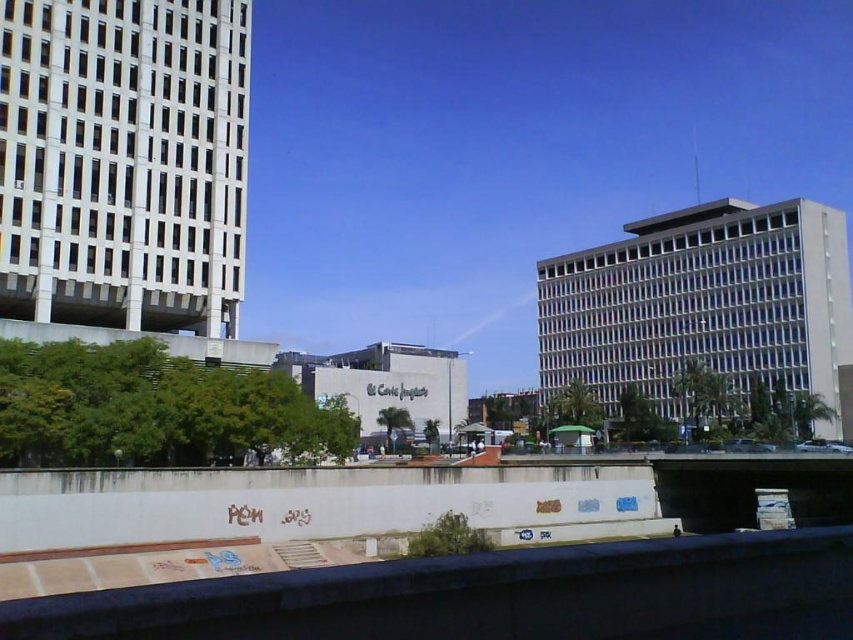
Question: Is white glass building at left closer to camera compared to white glass building at right?

Choices:
 (A) no
 (B) yes

Answer: (B)

Question: Can you confirm if white glass building at left is bigger than white glass building at right?

Choices:
 (A) yes
 (B) no

Answer: (B)

Question: Which point is closer to the camera taking this photo?

Choices:
 (A) (650, 266)
 (B) (111, 157)

Answer: (B)

Question: Is white glass building at left thinner than white glass building at right?

Choices:
 (A) no
 (B) yes

Answer: (B)

Question: Among these objects, which one is nearest to the camera?

Choices:
 (A) white glass building at left
 (B) white glass building at right

Answer: (A)